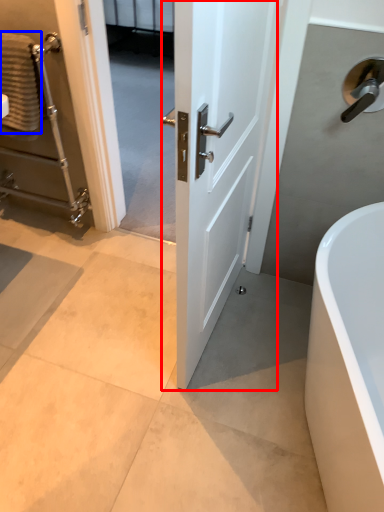
Question: Which object is further to the camera taking this photo, door (highlighted by a red box) or material (highlighted by a blue box)?

Choices:
 (A) door
 (B) material

Answer: (B)